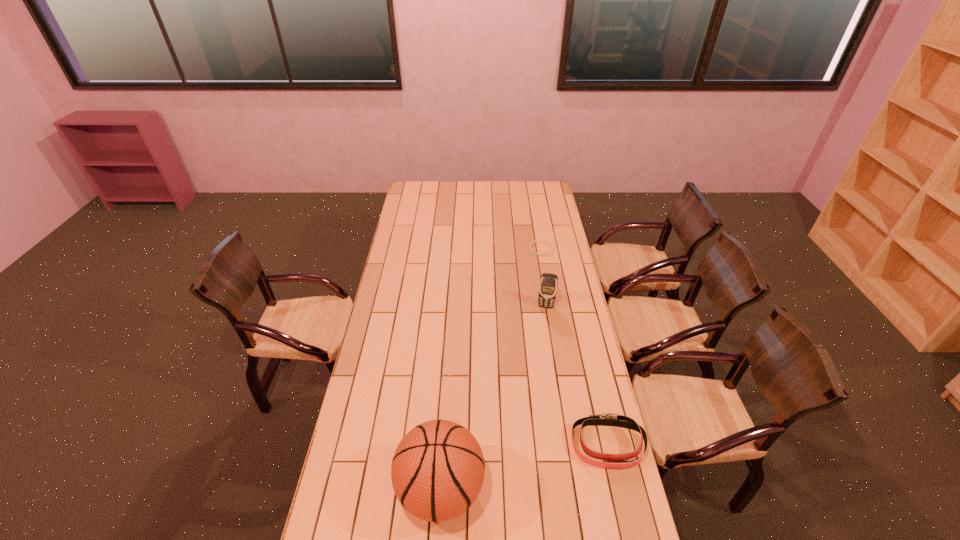
At what (x,y) coordinates should I click in order to perform the action: click on free space located 0.170m on the back of the third tallest object. Please return your answer as a coordinate pair (x, y). This screenshot has height=540, width=960. Looking at the image, I should click on (593, 381).

Find the location of a particular element. The image size is (960, 540). blank space located 0.380m on the surface of the bracelet showing star-shaped elements is located at coordinates (537, 307).

This screenshot has width=960, height=540. In order to click on vacant space located on the surface of the bracelet showing star-shaped elements in this screenshot , I will do `click(538, 292)`.

Locate an element on the screen. This screenshot has height=540, width=960. vacant space located 0.130m on the surface of the bracelet showing star-shaped elements is located at coordinates (540, 272).

Image resolution: width=960 pixels, height=540 pixels. In order to click on free region located 0.250m on the front face of the second farthest object in this screenshot , I will do `click(538, 352)`.

Where is `vacant space situated 0.400m on the front face of the second farthest object`? The width and height of the screenshot is (960, 540). vacant space situated 0.400m on the front face of the second farthest object is located at coordinates (532, 381).

I want to click on free space located on the front face of the second farthest object, so click(537, 357).

The height and width of the screenshot is (540, 960). In order to click on object that is at the near edge in this screenshot , I will do `click(437, 472)`.

Image resolution: width=960 pixels, height=540 pixels. Identify the location of dog collar at the right edge. (606, 419).

I want to click on bracelet at the right edge, so click(551, 245).